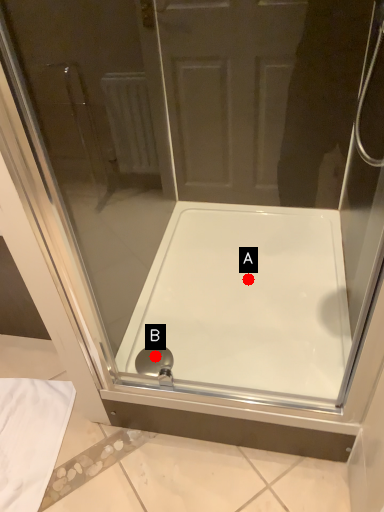
Question: Two points are circled on the image, labeled by A and B beside each circle. Which point is further to the camera?

Choices:
 (A) A is further
 (B) B is further

Answer: (A)